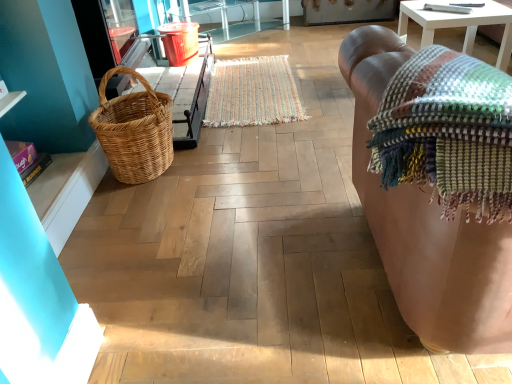
Find the location of a particular element. leather couch at right is located at coordinates (426, 229).

You are a GUI agent. You are given a task and a screenshot of the screen. Output one action in this format:
    pyautogui.click(x=<x>, y=<y>)
    Task: Click on the multicolored woven mat at center
    
    Given the screenshot: What is the action you would take?
    pyautogui.click(x=252, y=93)

What do you see at coordinates (448, 133) in the screenshot? I see `multicolored woven blanket at right` at bounding box center [448, 133].

At what (x,y) coordinates should I click in order to perform the action: click on leather couch at right. Please return your answer as a coordinate pair (x, y). The height and width of the screenshot is (384, 512). Looking at the image, I should click on (426, 229).

Which is in front, leather couch at right or woven natural picnic basket at left?

leather couch at right is closer to the camera.

From a real-world perspective, who is located lower, leather couch at right or woven natural picnic basket at left?

woven natural picnic basket at left is physically lower.

Identify the location of studio couch positioned vertically above the woven natural picnic basket at left (from a real-world perspective). (426, 229).

Is multicolored woven blanket at right a part of multicolored woven mat at center?

No.

Does multicolored woven mat at center come behind multicolored woven blanket at right?

Yes, multicolored woven mat at center is behind multicolored woven blanket at right.

From a real-world perspective, is multicolored woven mat at center physically below multicolored woven blanket at right?

Yes, from a real-world perspective, multicolored woven mat at center is beneath multicolored woven blanket at right.

Considering the points (211, 96) and (167, 126), which point is in front, point (211, 96) or point (167, 126)?

Point (167, 126)

Is multicolored woven mat at center looking in the opposite direction of woven natural picnic basket at left?

No, multicolored woven mat at center is not facing the opposite direction of woven natural picnic basket at left.

Which object is positioned more to the right, multicolored woven mat at center or woven natural picnic basket at left?

multicolored woven mat at center.

Based on the photo, is multicolored woven mat at center in contact with leather couch at right?

multicolored woven mat at center is not next to leather couch at right, and they're not touching.

Considering the sizes of multicolored woven mat at center and leather couch at right in the image, is multicolored woven mat at center wider or thinner than leather couch at right?

Clearly, multicolored woven mat at center has less width compared to leather couch at right.

At what (x,y) coordinates should I click in order to perform the action: click on studio couch directly beneath the multicolored woven blanket at right (from a real-world perspective). Please return your answer as a coordinate pair (x, y). This screenshot has height=384, width=512. Looking at the image, I should click on (426, 229).

Consider the image. Is leather couch at right at the back of multicolored woven blanket at right?

Yes, multicolored woven blanket at right is positioned with its back facing leather couch at right.

Considering the relative sizes of multicolored woven blanket at right and leather couch at right in the image provided, is multicolored woven blanket at right taller than leather couch at right?

Incorrect, the height of multicolored woven blanket at right is not larger of that of leather couch at right.

Which object is positioned more to the left, multicolored woven blanket at right or leather couch at right?

multicolored woven blanket at right.

Is woven natural picnic basket at left placed right next to multicolored woven blanket at right?

No, woven natural picnic basket at left is not next to multicolored woven blanket at right.

From the picture: How different are the orientations of woven natural picnic basket at left and multicolored woven blanket at right in degrees?

The facing directions of woven natural picnic basket at left and multicolored woven blanket at right are 88.9 degrees apart.

Does woven natural picnic basket at left have a lesser height compared to multicolored woven blanket at right?

Incorrect, the height of woven natural picnic basket at left does not fall short of that of multicolored woven blanket at right.

From the picture: Is multicolored woven blanket at right oriented away from woven natural picnic basket at left?

No, multicolored woven blanket at right is not facing away from woven natural picnic basket at left.

From the image's perspective, which one is positioned lower, multicolored woven blanket at right or woven natural picnic basket at left?

From the image's view, multicolored woven blanket at right is below.

Which is closer, [442,86] or [168,100]?

Point [442,86].

You are a GUI agent. You are given a task and a screenshot of the screen. Output one action in this format:
    pyautogui.click(x=<x>, y=<y>)
    Task: Click on the studio couch above the woven natural picnic basket at left (from a real-world perspective)
    This screenshot has height=384, width=512.
    Given the screenshot: What is the action you would take?
    click(426, 229)

Find the location of a particular element. The height and width of the screenshot is (384, 512). mat on the left of multicolored woven blanket at right is located at coordinates (252, 93).

Looking at the image, which one is located further to woven natural picnic basket at left, multicolored woven mat at center or multicolored woven blanket at right?

Based on the image, multicolored woven blanket at right appears to be further to woven natural picnic basket at left.

Which object lies nearer to the anchor point leather couch at right, woven natural picnic basket at left or multicolored woven mat at center?

The object closer to leather couch at right is woven natural picnic basket at left.

When comparing their distances from leather couch at right, does woven natural picnic basket at left or multicolored woven blanket at right seem further?

Based on the image, woven natural picnic basket at left appears to be further to leather couch at right.

From the image, which object appears to be farther from multicolored woven blanket at right, multicolored woven mat at center or woven natural picnic basket at left?

Among the two, multicolored woven mat at center is located further to multicolored woven blanket at right.

From the image, which object appears to be nearer to woven natural picnic basket at left, multicolored woven blanket at right or multicolored woven mat at center?

Among the two, multicolored woven mat at center is located nearer to woven natural picnic basket at left.

From the picture: Considering their positions, is leather couch at right positioned closer to woven natural picnic basket at left than multicolored woven mat at center?

multicolored woven mat at center is closer to woven natural picnic basket at left.

From the image, which object appears to be nearer to multicolored woven mat at center, woven natural picnic basket at left or leather couch at right?

woven natural picnic basket at left lies closer to multicolored woven mat at center than the other object.

Based on the photo, from the image, which object appears to be farther from leather couch at right, multicolored woven blanket at right or woven natural picnic basket at left?

Based on the image, woven natural picnic basket at left appears to be further to leather couch at right.

I want to click on studio couch between multicolored woven blanket at right and multicolored woven mat at center in the front-back direction, so click(426, 229).

Identify the location of blanket between woven natural picnic basket at left and leather couch at right. The height and width of the screenshot is (384, 512). (448, 133).

Image resolution: width=512 pixels, height=384 pixels. I want to click on picnic basket located between multicolored woven blanket at right and multicolored woven mat at center in the depth direction, so click(134, 130).

Find the location of a particular element. The width and height of the screenshot is (512, 384). picnic basket positioned between leather couch at right and multicolored woven mat at center from near to far is located at coordinates (134, 130).